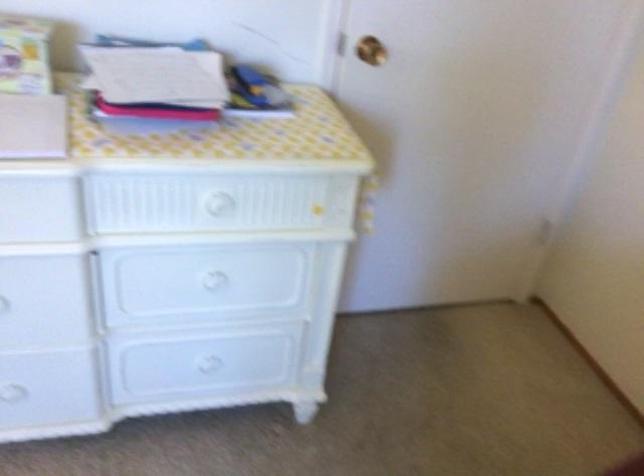
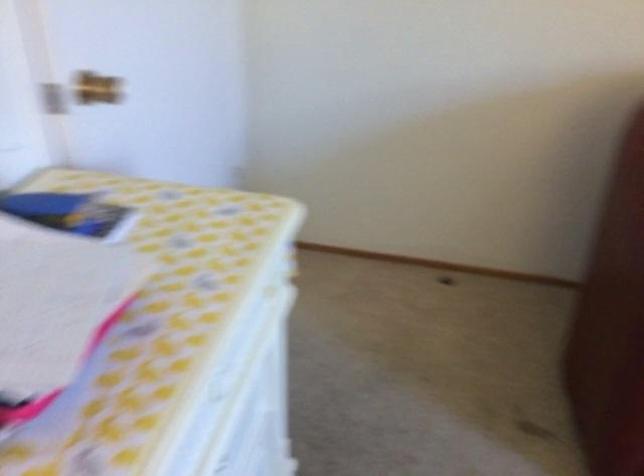
Based on the photo, first-person continuous shooting, in which direction is the camera rotating?

The camera rotated toward right-down.